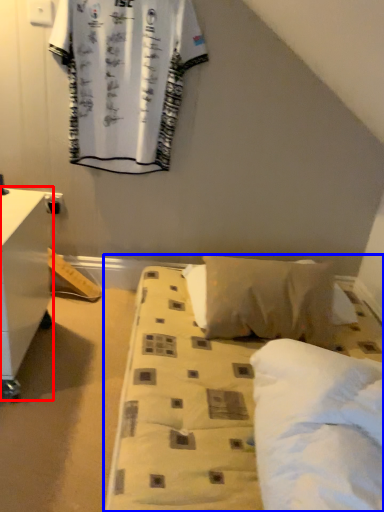
Question: Which of the following is the closest to the observer, nightstand (highlighted by a red box) or bed (highlighted by a blue box)?

Choices:
 (A) nightstand
 (B) bed

Answer: (B)